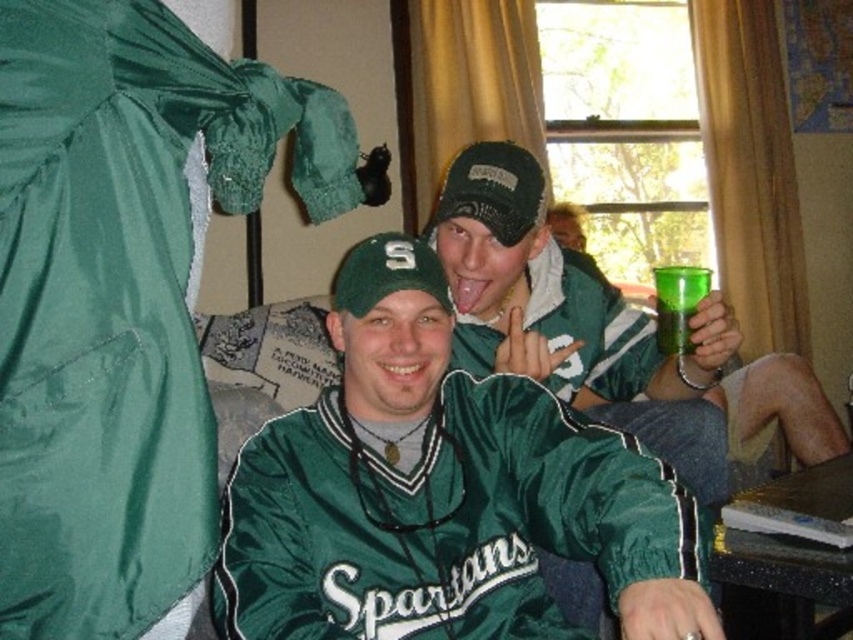
Is green satin baseball uniform at center shorter than green plastic cup at upper right?

Incorrect, green satin baseball uniform at center's height does not fall short of green plastic cup at upper right's.

Does green satin baseball uniform at center appear under green plastic cup at upper right?

Yes.

Who is more forward, (583,470) or (682,268)?

Positioned in front is point (583,470).

Where is `green satin baseball uniform at center`? This screenshot has height=640, width=853. green satin baseball uniform at center is located at coordinates (442, 520).

Is satin green dress at left positioned at the back of green satin baseball uniform at center?

No.

Between satin green dress at left and green satin baseball uniform at center, which one appears on the left side from the viewer's perspective?

From the viewer's perspective, satin green dress at left appears more on the left side.

Which is in front, point (83, 147) or point (374, 540)?

Point (83, 147) is more forward.

The height and width of the screenshot is (640, 853). Identify the location of satin green dress at left. (123, 296).

Is point (260, 90) positioned in front of point (698, 275)?

Yes, point (260, 90) is in front of point (698, 275).

Between satin green dress at left and green plastic cup at upper right, which one appears on the right side from the viewer's perspective?

green plastic cup at upper right

Between point (38, 221) and point (693, 275), which one is positioned behind?

Point (693, 275)

Where is `satin green dress at left`? Image resolution: width=853 pixels, height=640 pixels. satin green dress at left is located at coordinates (123, 296).